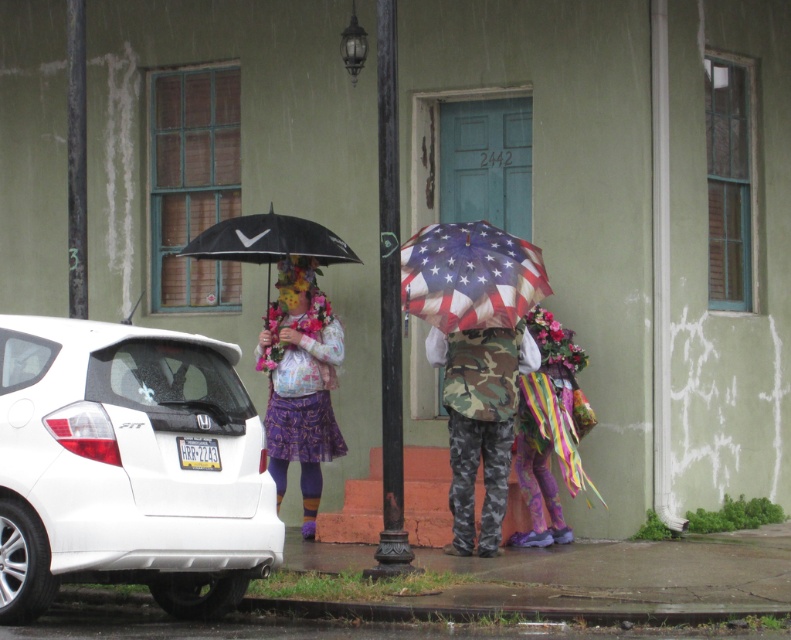
Question: Which object is farther from the camera taking this photo?

Choices:
 (A) camouflage fabric pants at center
 (B) black matte umbrella at left
 (C) matte floral skirt at center
 (D) white matte car at left

Answer: (A)

Question: Is camo pants at center positioned at the back of american flag print umbrella at center?

Choices:
 (A) yes
 (B) no

Answer: (A)

Question: Which of these objects is positioned farthest from the black matte umbrella at left?

Choices:
 (A) american flag print umbrella at center
 (B) white matte car at left

Answer: (B)

Question: Can you confirm if camo pants at center is positioned to the left of american flag print umbrella at center?

Choices:
 (A) yes
 (B) no

Answer: (A)

Question: Which is nearer to the matte floral skirt at center?

Choices:
 (A) black matte umbrella at left
 (B) camo pants at center
 (C) american flag print umbrella at center

Answer: (A)

Question: Does camouflage-patterned pants at center have a smaller size compared to black matte umbrella at left?

Choices:
 (A) no
 (B) yes

Answer: (A)